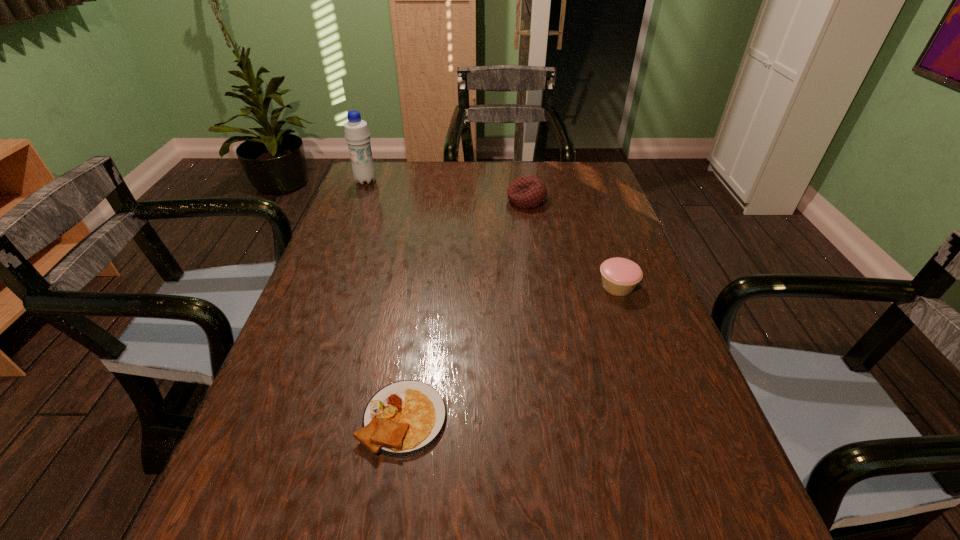
The height and width of the screenshot is (540, 960). In order to click on vacant area that lies between the third tallest object and the farthest object in this screenshot , I will do `click(492, 233)`.

Locate which object is the third closest to the second shortest object. Please provide its 2D coordinates. Your answer should be formatted as a tuple, i.e. [(x, y)], where the tuple contains the x and y coordinates of a point satisfying the conditions above.

[(357, 135)]

Identify which object is the closest to the water bottle. Please provide its 2D coordinates. Your answer should be formatted as a tuple, i.e. [(x, y)], where the tuple contains the x and y coordinates of a point satisfying the conditions above.

[(526, 192)]